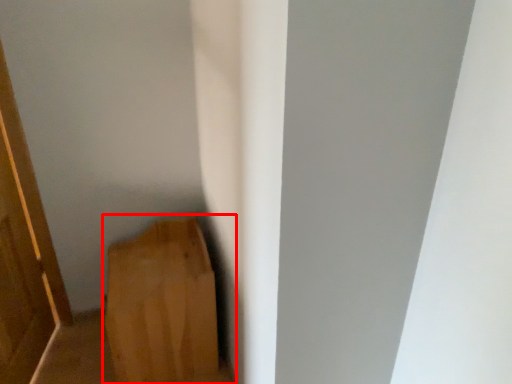
Question: From the image, what is the correct spatial relationship of furniture (annotated by the red box) in relation to door?

Choices:
 (A) left
 (B) right

Answer: (B)